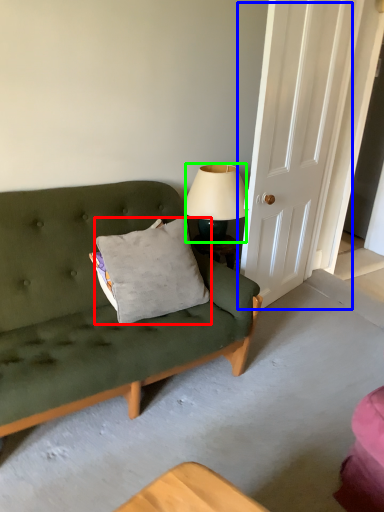
Question: Which object is the farthest from pillow (highlighted by a red box)? Choose among these: door (highlighted by a blue box) or lamp (highlighted by a green box).

Choices:
 (A) door
 (B) lamp

Answer: (A)